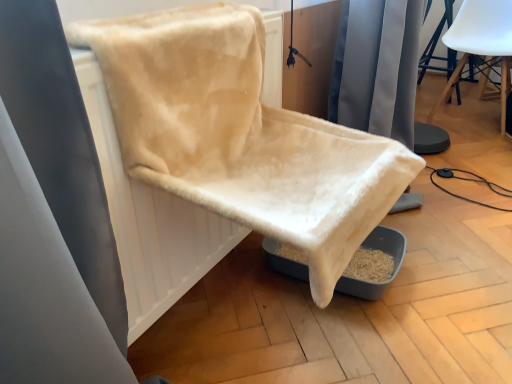
At what (x,y) coordinates should I click in order to perform the action: click on free region under white matte chair at upper right, which ranks as the 2th chair in left-to-right order (from a real-world perspective). Please return your answer as a coordinate pair (x, y). The image size is (512, 384). Looking at the image, I should click on click(456, 115).